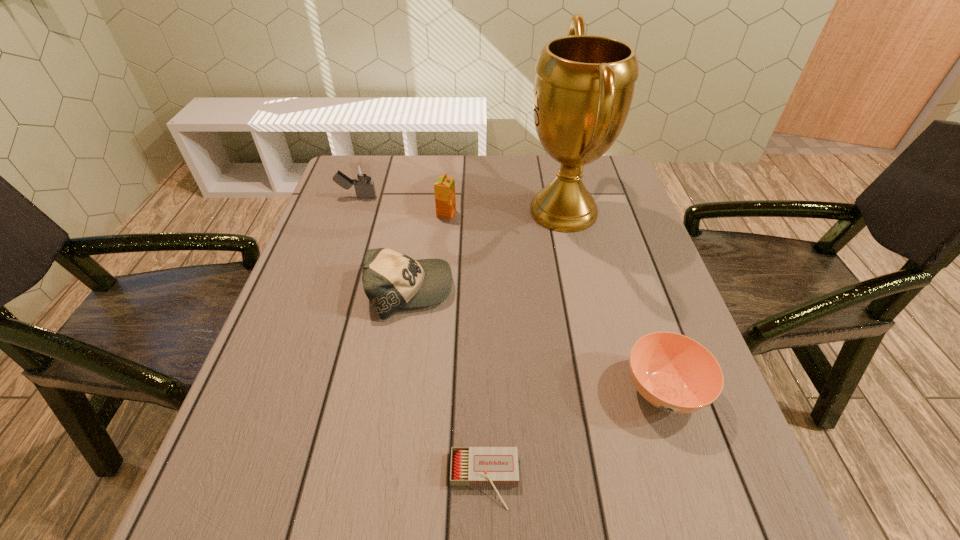
You are a GUI agent. You are given a task and a screenshot of the screen. Output one action in this format:
    pyautogui.click(x=<x>, y=<y>)
    Task: Click on the free space between the fifth farthest object and the shortest object
    This screenshot has height=540, width=960.
    Given the screenshot: What is the action you would take?
    pyautogui.click(x=574, y=435)

You are a GUI agent. You are given a task and a screenshot of the screen. Output one action in this format:
    pyautogui.click(x=<x>, y=<y>)
    Task: Click on the free space between the trophy cup and the leftmost object
    The width and height of the screenshot is (960, 540).
    Given the screenshot: What is the action you would take?
    460,204

Where is `empty space that is in between the leftmost object and the orange juice`? Image resolution: width=960 pixels, height=540 pixels. empty space that is in between the leftmost object and the orange juice is located at coordinates (401, 205).

Where is `empty space that is in between the matchbox and the soup bowl`? empty space that is in between the matchbox and the soup bowl is located at coordinates tap(574, 435).

Where is `vacant space in between the soup bowl and the igniter`? vacant space in between the soup bowl and the igniter is located at coordinates (510, 293).

Locate an element on the screen. The width and height of the screenshot is (960, 540). vacant area that lies between the tallest object and the leftmost object is located at coordinates (460, 204).

The image size is (960, 540). Identify the location of vacant space that is in between the orange juice and the tallest object. (505, 213).

Identify the location of object that ranks as the second closest to the second nearest object. Image resolution: width=960 pixels, height=540 pixels. (584, 84).

Find the location of a particular element. object that is the fourth closest to the second nearest object is located at coordinates (444, 188).

This screenshot has height=540, width=960. Identify the location of free spot that satisfies the following two spatial constraints: 1. on the surface of the trophy cup with symbols; 2. on the striking surface of the shortest object. (623, 481).